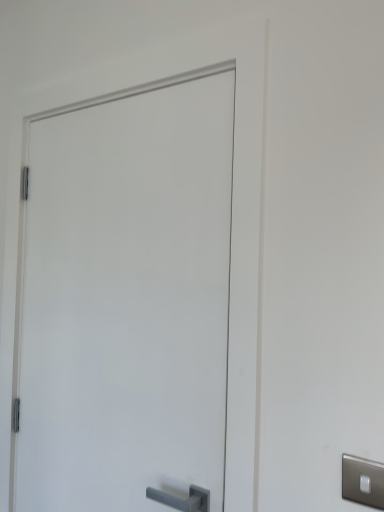
Question: Does point (365, 462) appear closer or farther from the camera than point (36, 507)?

Choices:
 (A) closer
 (B) farther

Answer: (A)

Question: From the image's perspective, is satin nickel switch at lower right located above or below white matte door at center?

Choices:
 (A) above
 (B) below

Answer: (B)

Question: Considering the positions of satin nickel switch at lower right and white matte door at center in the image, is satin nickel switch at lower right taller or shorter than white matte door at center?

Choices:
 (A) short
 (B) tall

Answer: (A)

Question: Considering the positions of white matte door at center and satin nickel switch at lower right in the image, is white matte door at center bigger or smaller than satin nickel switch at lower right?

Choices:
 (A) small
 (B) big

Answer: (B)

Question: From the image's perspective, is white matte door at center positioned above or below satin nickel switch at lower right?

Choices:
 (A) above
 (B) below

Answer: (A)

Question: From their relative heights in the image, would you say white matte door at center is taller or shorter than satin nickel switch at lower right?

Choices:
 (A) short
 (B) tall

Answer: (B)

Question: Looking at their shapes, would you say white matte door at center is wider or thinner than satin nickel switch at lower right?

Choices:
 (A) wide
 (B) thin

Answer: (A)